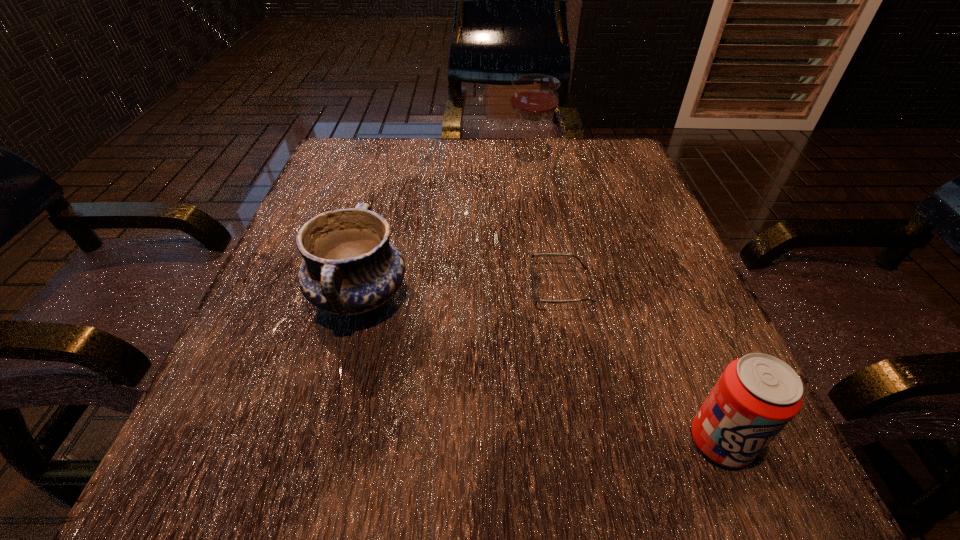
What are the coordinates of `vacant position at the far left corner of the desktop` in the screenshot? It's located at (377, 166).

In the image, there is a desktop. Where is `vacant space at the far right corner`? vacant space at the far right corner is located at coordinates (628, 191).

This screenshot has width=960, height=540. In order to click on free space between the farthest object and the shortest object in this screenshot , I will do `click(545, 225)`.

Locate an element on the screen. vacant region between the nearest object and the shortest object is located at coordinates (640, 364).

Locate an element on the screen. The height and width of the screenshot is (540, 960). vacant area that lies between the soda can and the shortest object is located at coordinates (640, 364).

At what (x,y) coordinates should I click in order to perform the action: click on vacant point located between the sunglasses and the nearest object. Please return your answer as a coordinate pair (x, y). The width and height of the screenshot is (960, 540). Looking at the image, I should click on (640, 364).

The height and width of the screenshot is (540, 960). Identify the location of free spot between the tallest object and the pottery. (444, 230).

Find the location of a particular element. Image resolution: width=960 pixels, height=540 pixels. empty space that is in between the rightmost object and the tallest object is located at coordinates (625, 302).

Locate an element on the screen. free point between the rightmost object and the wineglass is located at coordinates (625, 302).

Where is `unoccupied position between the wineglass and the soda can`? Image resolution: width=960 pixels, height=540 pixels. unoccupied position between the wineglass and the soda can is located at coordinates (625, 302).